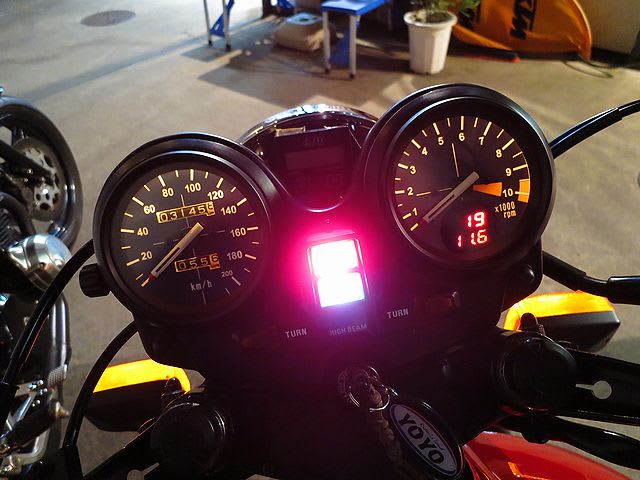
Where is `light`? light is located at coordinates (332, 267).